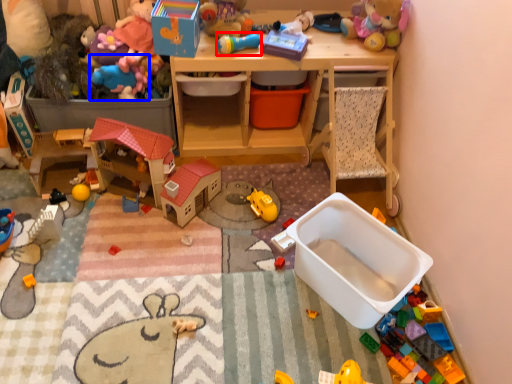
Question: Which object is further to the camera taking this photo, toy (highlighted by a red box) or toy (highlighted by a blue box)?

Choices:
 (A) toy
 (B) toy

Answer: (B)